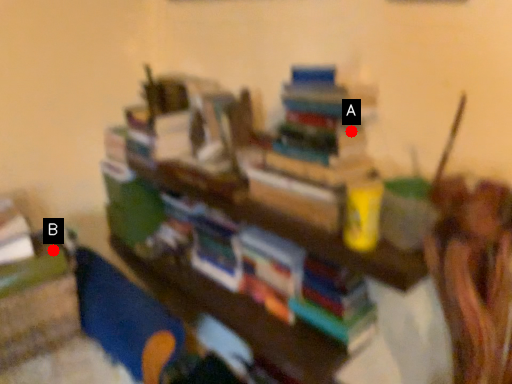
Question: Two points are circled on the image, labeled by A and B beside each circle. Which point appears closest to the camera in this image?

Choices:
 (A) A is closer
 (B) B is closer

Answer: (A)